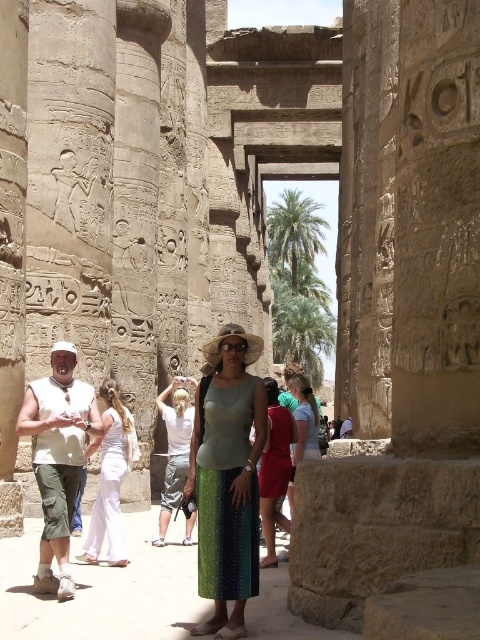
You are an archaeologist examining the clothing of a modern visitor in an ancient Egyptian temple. You notice the green textured skirt at center and the white cotton shirt at center. Which item of clothing has a greater width?

The green textured skirt at center has a greater width than the white cotton shirt at center according to the description.

You are standing in the ancient Egyptian temple and want to walk from the point marked as point (273, 449) to the point marked as point (168, 476). According to the scene description, will you be moving towards the background or the foreground of the temple?

According to the description, point (273, 449) is in front of point (168, 476). Therefore, moving from point (273, 449) to point (168, 476) means you are moving towards the background of the temple.